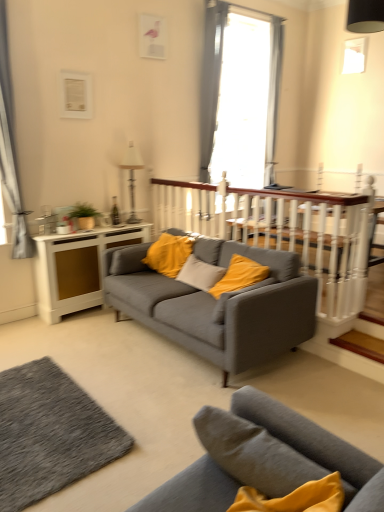
The height and width of the screenshot is (512, 384). Find the location of `free space that is in between textured gray rug at lower left and matte gray couch at center, which is the first studio couch from back to front`. free space that is in between textured gray rug at lower left and matte gray couch at center, which is the first studio couch from back to front is located at coordinates (122, 375).